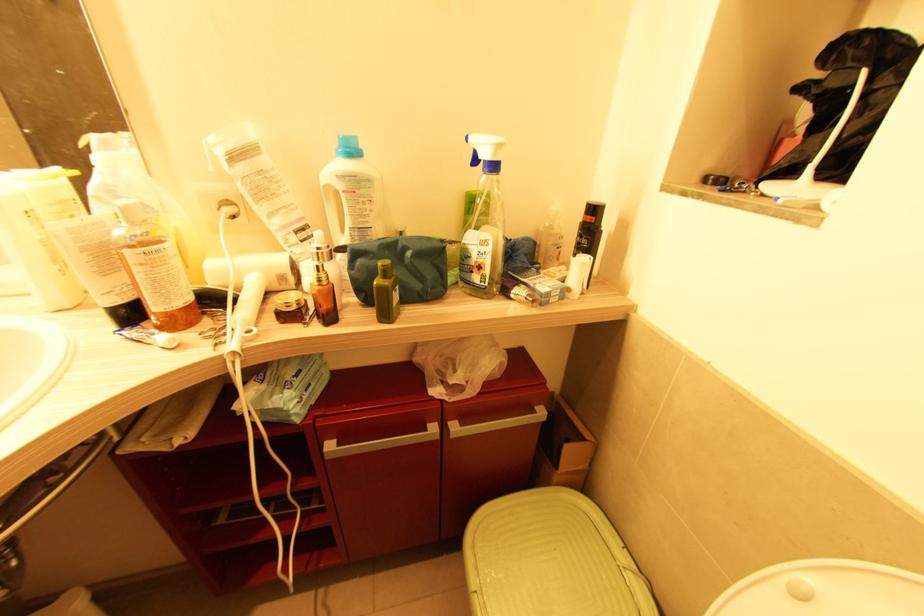
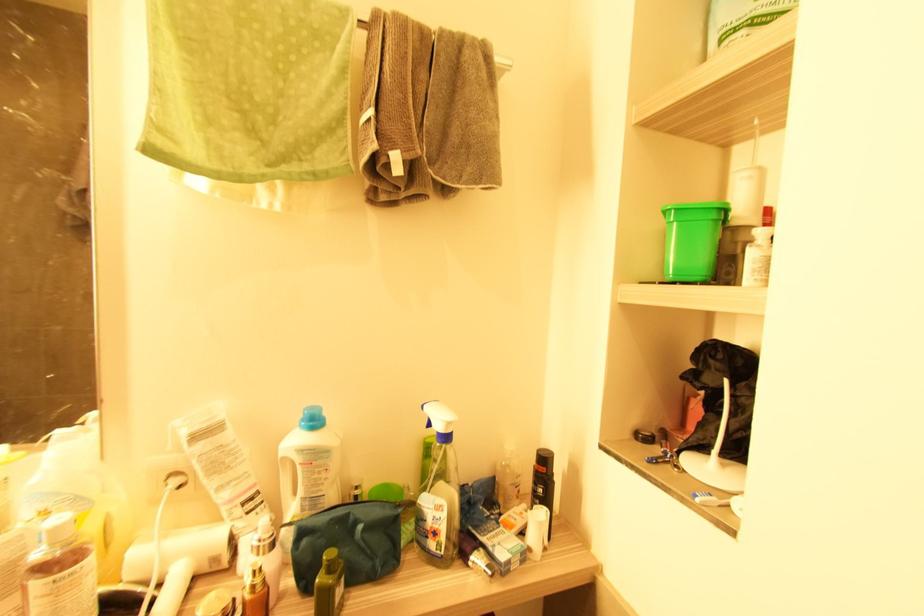
Locate, in the second image, the point that corresponds to [473,273] in the first image.

(429, 539)